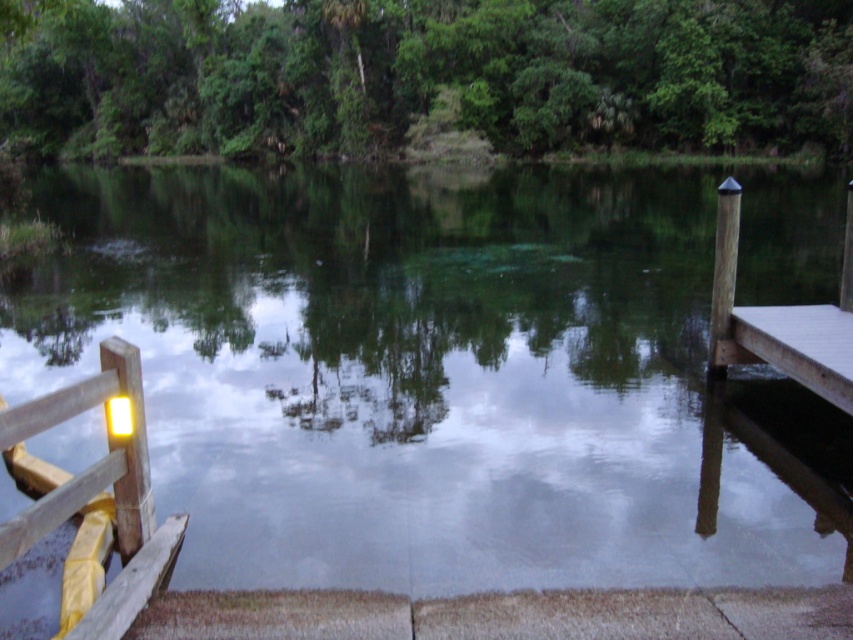
Does green reflective water at center have a lesser width compared to brown wooden dock at right?

No.

Can you confirm if green reflective water at center is positioned below brown wooden dock at right?

No, green reflective water at center is not below brown wooden dock at right.

In order to click on green reflective water at center in this screenshot , I will do `click(416, 374)`.

Between green reflective water at center and yellow painted wood at left, which one appears on the left side from the viewer's perspective?

yellow painted wood at left

Between point (311, 198) and point (126, 496), which one is positioned behind?

The point (311, 198) is more distant.

Find the location of a particular element. This screenshot has height=640, width=853. green reflective water at center is located at coordinates (416, 374).

Which is in front, point (123, 548) or point (788, 330)?

Point (123, 548)

Is yellow painted wood at left positioned before brown wooden dock at right?

Yes, it is in front of brown wooden dock at right.

At what (x,y) coordinates should I click in order to perform the action: click on yellow painted wood at left. Please return your answer as a coordinate pair (x, y). Looking at the image, I should click on (97, 486).